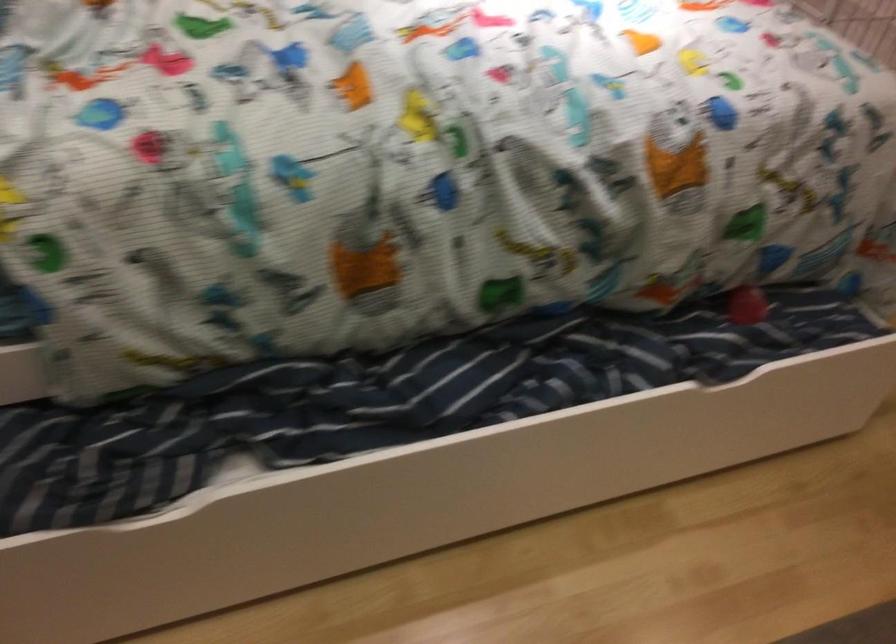
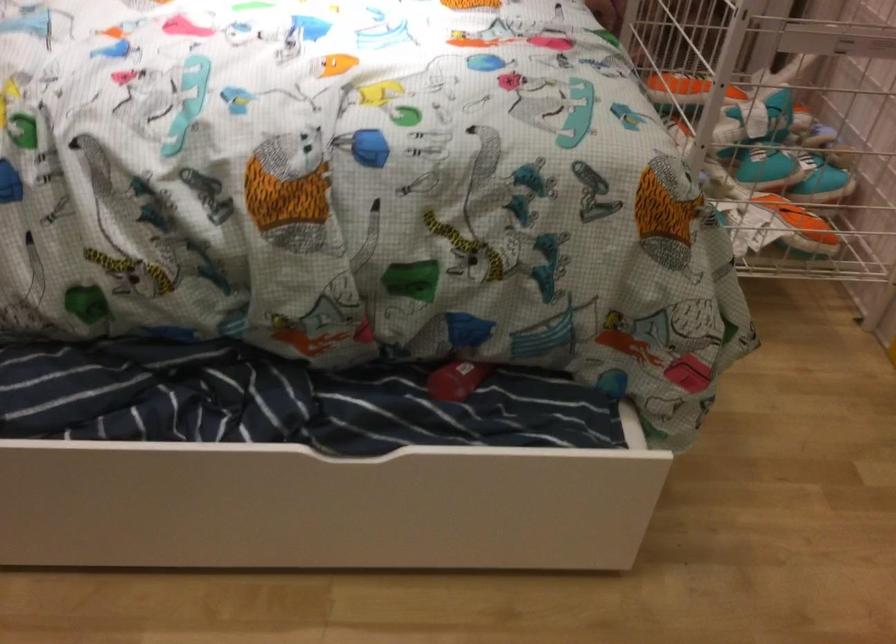
Question: The images are taken continuously from a first-person perspective. In which direction is your viewpoint rotating?

Choices:
 (A) Left
 (B) Right
 (C) Up
 (D) Down

Answer: (A)